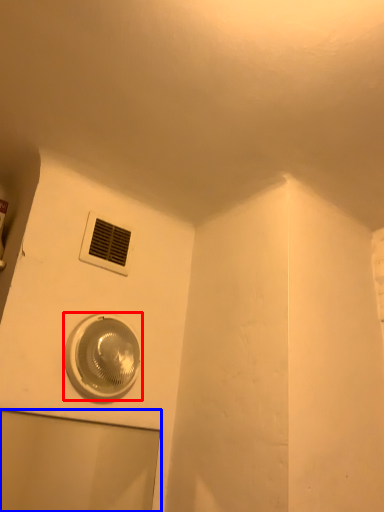
Question: Which point is further to the camera, home appliance (highlighted by a red box) or glass door (highlighted by a blue box)?

Choices:
 (A) home appliance
 (B) glass door

Answer: (A)